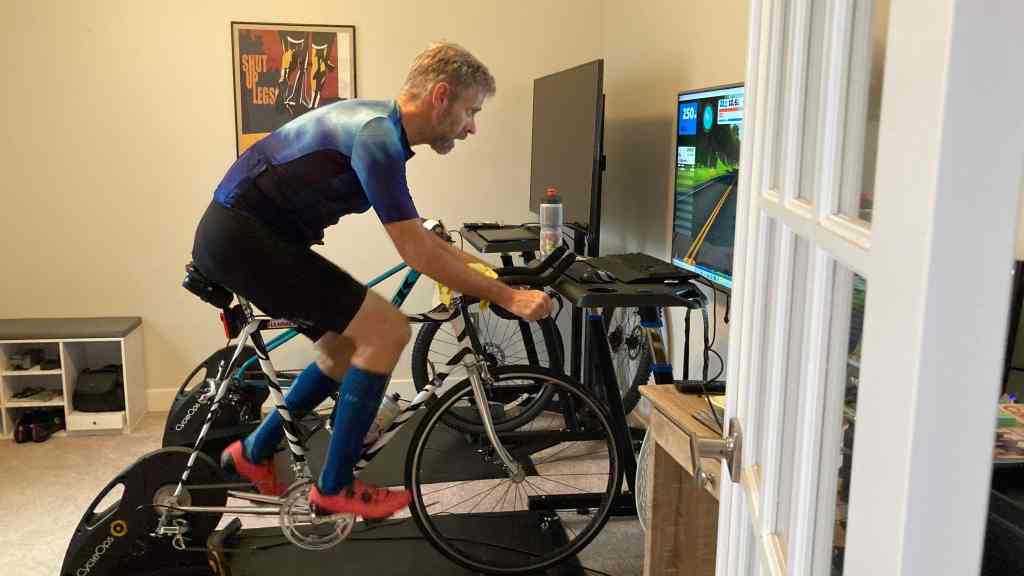
Locate an element on the screen. This screenshot has width=1024, height=576. monitor/tv is located at coordinates (719, 149), (557, 134).